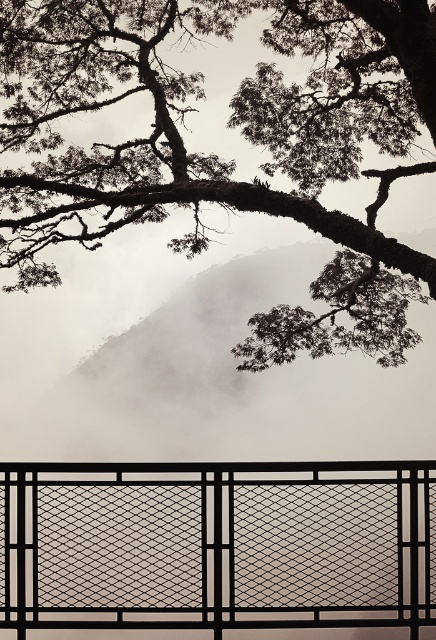
Who is more forward, (377, 120) or (422, 518)?

Point (422, 518) is in front.

Image resolution: width=436 pixels, height=640 pixels. What do you see at coordinates (217, 156) in the screenshot?
I see `dark bark tree at upper center` at bounding box center [217, 156].

Locate an element on the screen. dark bark tree at upper center is located at coordinates (217, 156).